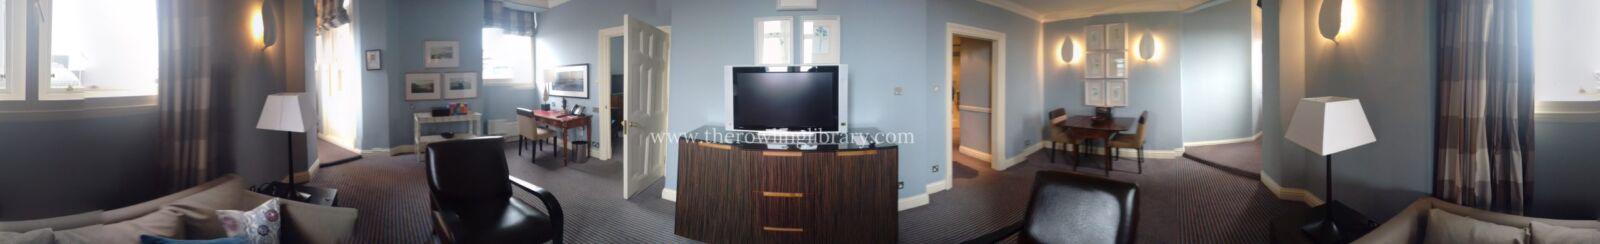
At what (x,y) coordinates should I click in order to perform the action: click on doorways. Please return your answer as a coordinate pair (x, y). This screenshot has height=244, width=1600. Looking at the image, I should click on (973, 110), (621, 82).